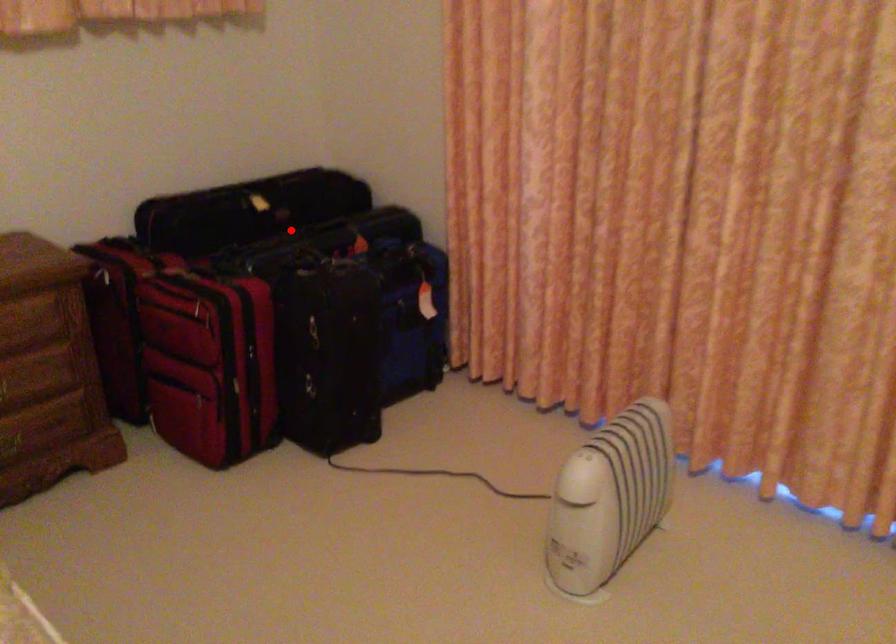
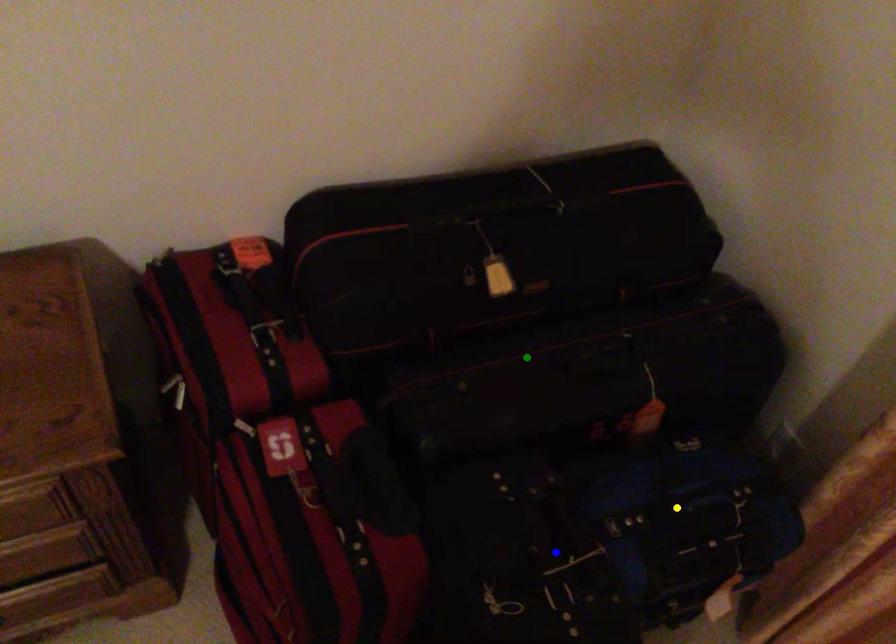
Question: I am providing you with two images of the same scene from different viewpoints. A red point is marked on the first image. You are given multiple points on the second image. Can you choose the point in image 2 that corresponds to the point in image 1?

Choices:
 (A) blue point
 (B) green point
 (C) yellow point

Answer: (B)